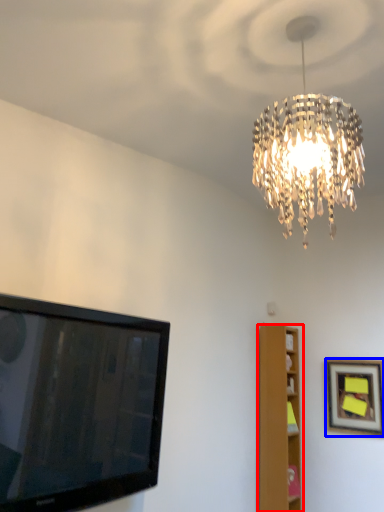
Question: Which of the following is the closest to the observer, furniture (highlighted by a red box) or picture frame (highlighted by a blue box)?

Choices:
 (A) furniture
 (B) picture frame

Answer: (B)